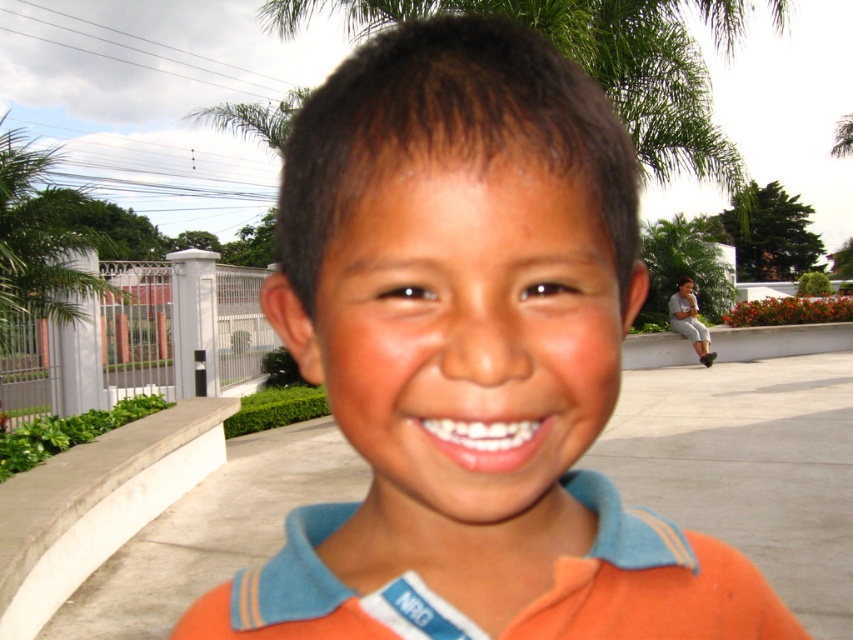
Is green leafy palm tree at upper center shorter than green leafy palm tree at upper left?

No.

Is point (640, 172) farther from viewer compared to point (19, 289)?

No, it is in front of (19, 289).

Where is `green leafy palm tree at upper center`? This screenshot has width=853, height=640. green leafy palm tree at upper center is located at coordinates (598, 61).

Is orange cotton shirt at center above green leafy palm tree at upper left?

Incorrect, orange cotton shirt at center is not positioned above green leafy palm tree at upper left.

The width and height of the screenshot is (853, 640). In order to click on orange cotton shirt at center in this screenshot , I will do `click(469, 360)`.

In the scene shown: Does orange cotton polo shirt at center appear on the right side of green leafy palm tree at upper left?

Correct, you'll find orange cotton polo shirt at center to the right of green leafy palm tree at upper left.

Does orange cotton polo shirt at center appear under green leafy palm tree at upper left?

Yes.

What do you see at coordinates (650, 580) in the screenshot? I see `orange cotton polo shirt at center` at bounding box center [650, 580].

I want to click on orange cotton polo shirt at center, so click(x=650, y=580).